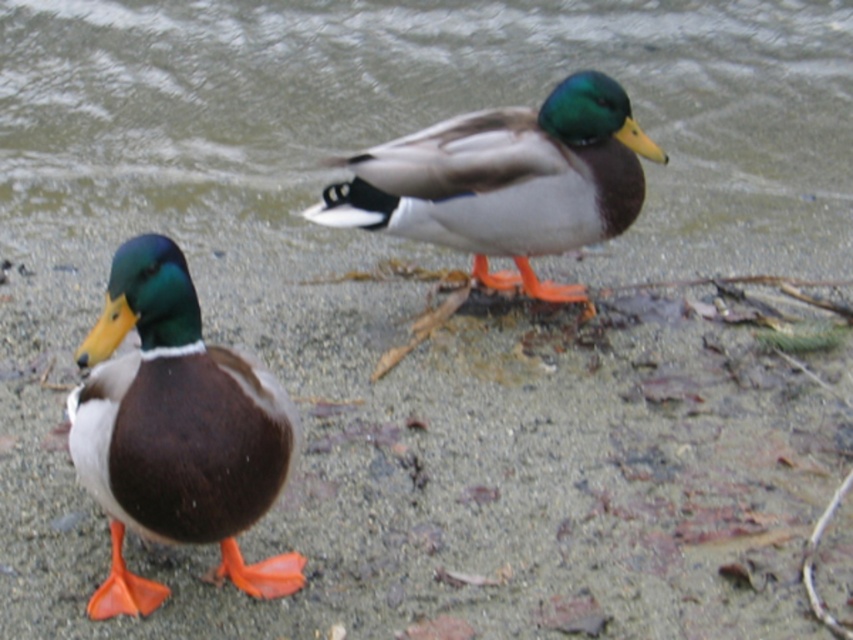
Is clear water at upper center smaller than matte brown duck at left?

No, clear water at upper center is not smaller than matte brown duck at left.

Which is above, clear water at upper center or matte brown duck at left?

clear water at upper center

This screenshot has height=640, width=853. I want to click on clear water at upper center, so click(x=422, y=112).

Which is in front, point (61, 65) or point (592, 83)?

Point (592, 83)

Does point (834, 125) come in front of point (564, 156)?

No.

Identify the location of clear water at upper center. The height and width of the screenshot is (640, 853). (422, 112).

Does matte brown duck at left have a smaller size compared to shiny brown duck at center?

Yes.

Describe the element at coordinates (177, 432) in the screenshot. I see `matte brown duck at left` at that location.

Locate an element on the screen. matte brown duck at left is located at coordinates (177, 432).